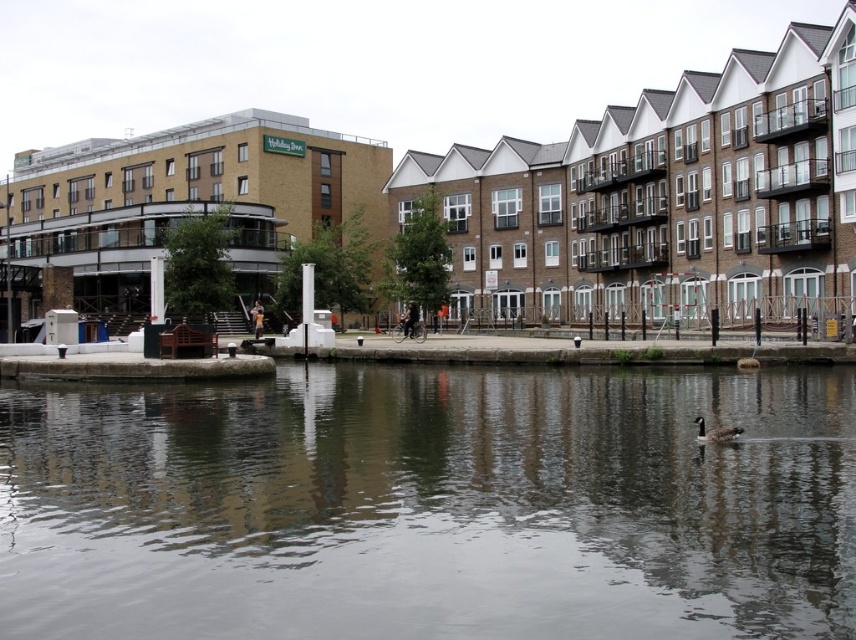
Can you confirm if smooth concrete water at center is wider than brown matte duck at lower center?

Yes.

Can you confirm if smooth concrete water at center is thinner than brown matte duck at lower center?

Incorrect, smooth concrete water at center's width is not less than brown matte duck at lower center's.

Locate an element on the screen. Image resolution: width=856 pixels, height=640 pixels. smooth concrete water at center is located at coordinates (431, 506).